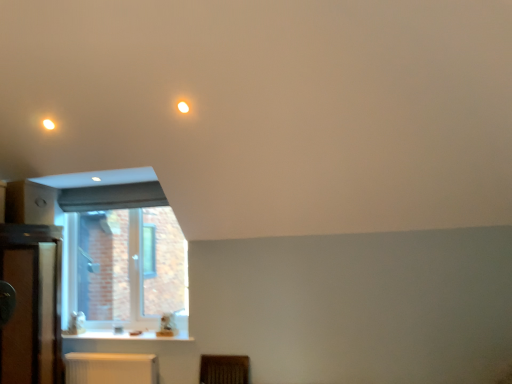
Question: Is white glossy counter top at lower left in front of white plastic radiator at lower center?

Choices:
 (A) yes
 (B) no

Answer: (B)

Question: Is white glossy counter top at lower left further to camera compared to white plastic radiator at lower center?

Choices:
 (A) yes
 (B) no

Answer: (A)

Question: Is white glossy counter top at lower left next to white plastic radiator at lower center and touching it?

Choices:
 (A) yes
 (B) no

Answer: (B)

Question: Can you confirm if white glossy counter top at lower left is shorter than white plastic radiator at lower center?

Choices:
 (A) no
 (B) yes

Answer: (B)

Question: From the image's perspective, does white glossy counter top at lower left appear higher than white plastic radiator at lower center?

Choices:
 (A) yes
 (B) no

Answer: (A)

Question: From a real-world perspective, is wooden dresser at left positioned above or below matte white light fixture at upper left, which is counted as the 2th lighting, starting from the right?

Choices:
 (A) above
 (B) below

Answer: (B)

Question: Is wooden dresser at left wider or thinner than matte white light fixture at upper left, the 1th lighting positioned from the back?

Choices:
 (A) thin
 (B) wide

Answer: (B)

Question: Is point [x=50, y=294] positioned closer to the camera than point [x=47, y=125]?

Choices:
 (A) farther
 (B) closer

Answer: (A)

Question: Is wooden dresser at left situated inside matte white light fixture at upper left, which is counted as the 2th lighting, starting from the right, or outside?

Choices:
 (A) inside
 (B) outside

Answer: (B)

Question: Considering their positions, is wooden dresser at left located in front of or behind clear glass window at lower left?

Choices:
 (A) behind
 (B) front

Answer: (B)

Question: Looking at their shapes, would you say wooden dresser at left is wider or thinner than clear glass window at lower left?

Choices:
 (A) wide
 (B) thin

Answer: (A)

Question: From their relative heights in the image, would you say wooden dresser at left is taller or shorter than clear glass window at lower left?

Choices:
 (A) tall
 (B) short

Answer: (A)

Question: From a real-world perspective, is wooden dresser at left above or below clear glass window at lower left?

Choices:
 (A) below
 (B) above

Answer: (A)

Question: In terms of height, does matte white light fixture at upper left, the 1th lighting positioned from the back, look taller or shorter compared to white plastic radiator at lower center?

Choices:
 (A) short
 (B) tall

Answer: (A)

Question: Considering the positions of matte white light fixture at upper left, which is counted as the 2th lighting, starting from the right, and white plastic radiator at lower center in the image, is matte white light fixture at upper left, which is counted as the 2th lighting, starting from the right, wider or thinner than white plastic radiator at lower center?

Choices:
 (A) wide
 (B) thin

Answer: (B)